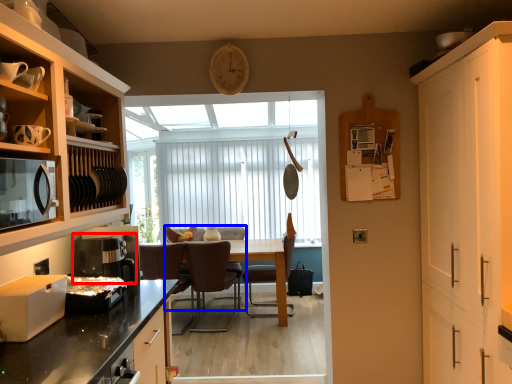
Question: Which object appears farthest to the camera in this image, coffee machine (highlighted by a red box) or chair (highlighted by a blue box)?

Choices:
 (A) coffee machine
 (B) chair

Answer: (B)